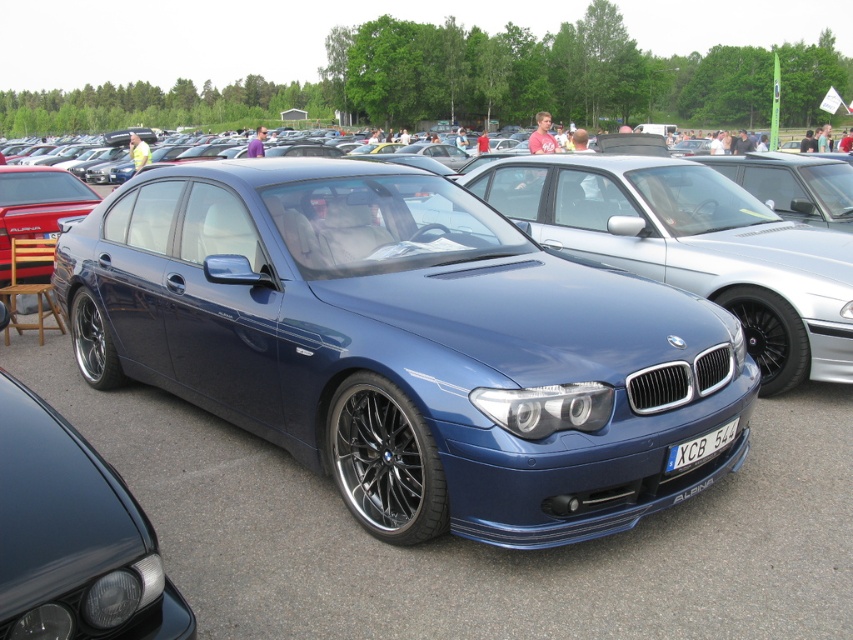
Can you confirm if satin blue car at center is wider than white plastic license plate at center?

Indeed, satin blue car at center has a greater width compared to white plastic license plate at center.

Does satin blue car at center have a larger size compared to white plastic license plate at center?

Correct, satin blue car at center is larger in size than white plastic license plate at center.

Is point (662, 260) farther from viewer compared to point (692, 451)?

Yes, it is behind point (692, 451).

Identify the location of satin blue car at center. (693, 248).

Based on the photo, is metallic blue sedan at center to the left of satin blue car at center from the viewer's perspective?

Indeed, metallic blue sedan at center is positioned on the left side of satin blue car at center.

Which is above, metallic blue sedan at center or satin blue car at center?

satin blue car at center is above.

The width and height of the screenshot is (853, 640). In order to click on metallic blue sedan at center in this screenshot , I will do `click(405, 346)`.

At what (x,y) coordinates should I click in order to perform the action: click on metallic blue sedan at center. Please return your answer as a coordinate pair (x, y). Looking at the image, I should click on (405, 346).

Between shiny red sedan at left and white plastic license plate at center, which one has more height?

shiny red sedan at left is taller.

Which is in front, point (35, 204) or point (711, 433)?

Point (711, 433) is in front.

Which is in front, point (57, 173) or point (730, 422)?

Point (730, 422) is more forward.

Where is `shiny red sedan at left`? The image size is (853, 640). shiny red sedan at left is located at coordinates (36, 205).